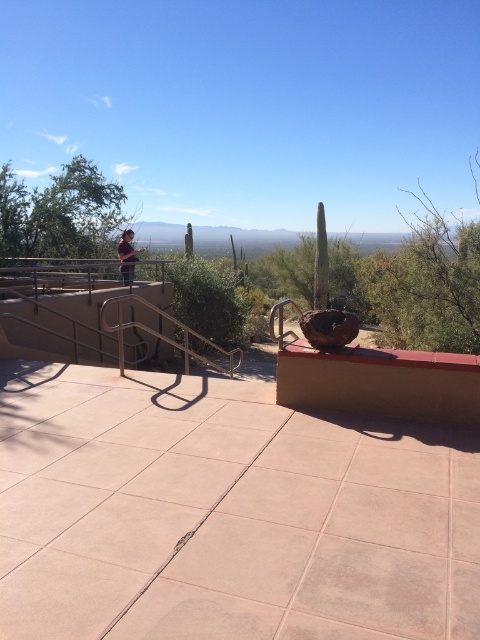
Question: Considering the real-world distances, which object is closest to the matte brown shirt at upper left?

Choices:
 (A) green leafy bush at upper left
 (B) brown concrete ledge at lower right

Answer: (A)

Question: Which point is farther from the camera taking this photo?

Choices:
 (A) (137, 252)
 (B) (462, 381)

Answer: (A)

Question: Which of the following is the farthest from the observer?

Choices:
 (A) matte brown shirt at upper left
 (B) brown concrete ledge at lower right

Answer: (A)

Question: Is the position of brown concrete ledge at lower right more distant than that of green leafy bush at upper left?

Choices:
 (A) yes
 (B) no

Answer: (B)

Question: Does brown concrete ledge at lower right have a greater width compared to matte brown shirt at upper left?

Choices:
 (A) no
 (B) yes

Answer: (A)

Question: Does green leafy bush at upper left appear on the right side of matte brown shirt at upper left?

Choices:
 (A) no
 (B) yes

Answer: (A)